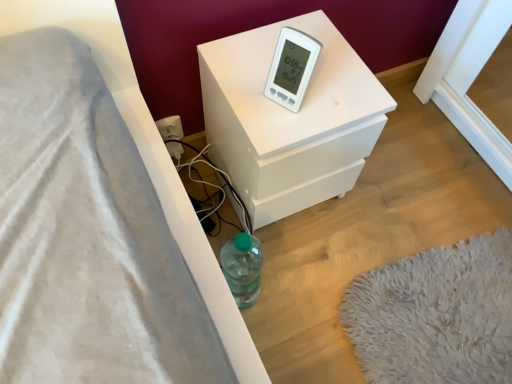
Image resolution: width=512 pixels, height=384 pixels. Identify the location of free space in front of white plastic thermometer at upper center. (284, 127).